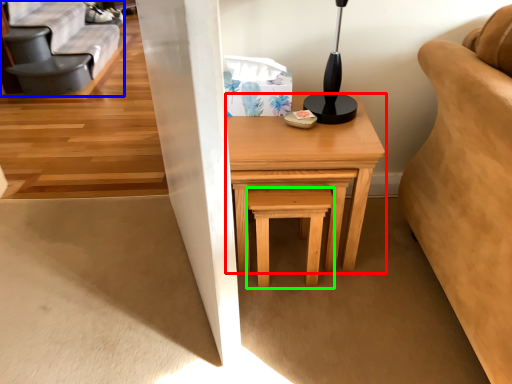
Question: Estimate the real-world distances between objects in this image. Which object is closer to table (highlighted by a red box), futon (highlighted by a blue box) or stool (highlighted by a green box)?

Choices:
 (A) futon
 (B) stool

Answer: (B)